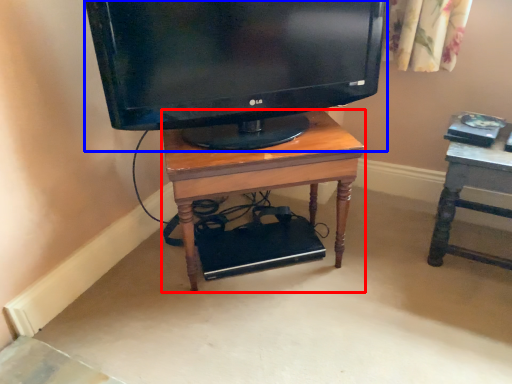
Question: Which object is closer to the camera taking this photo, desk (highlighted by a red box) or television (highlighted by a blue box)?

Choices:
 (A) desk
 (B) television

Answer: (B)